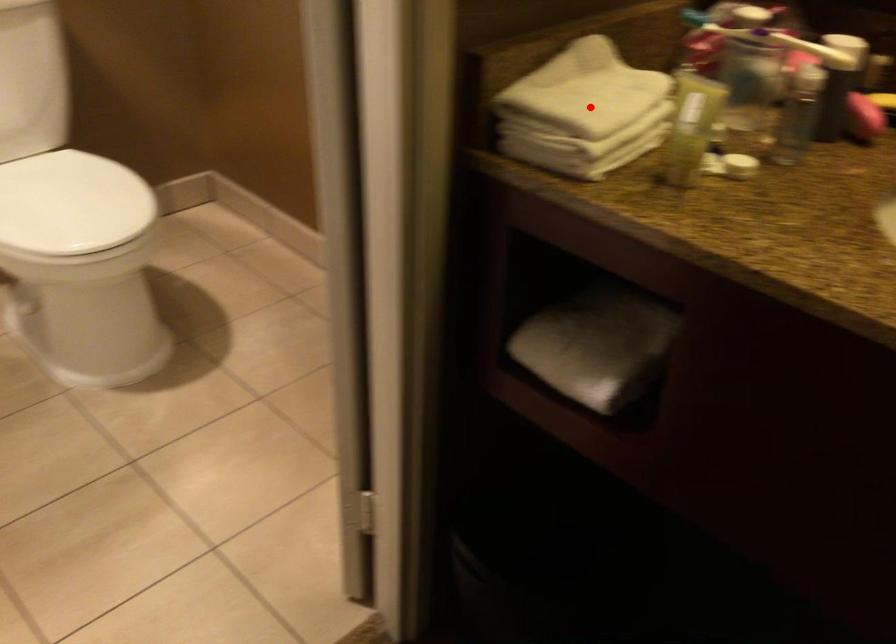
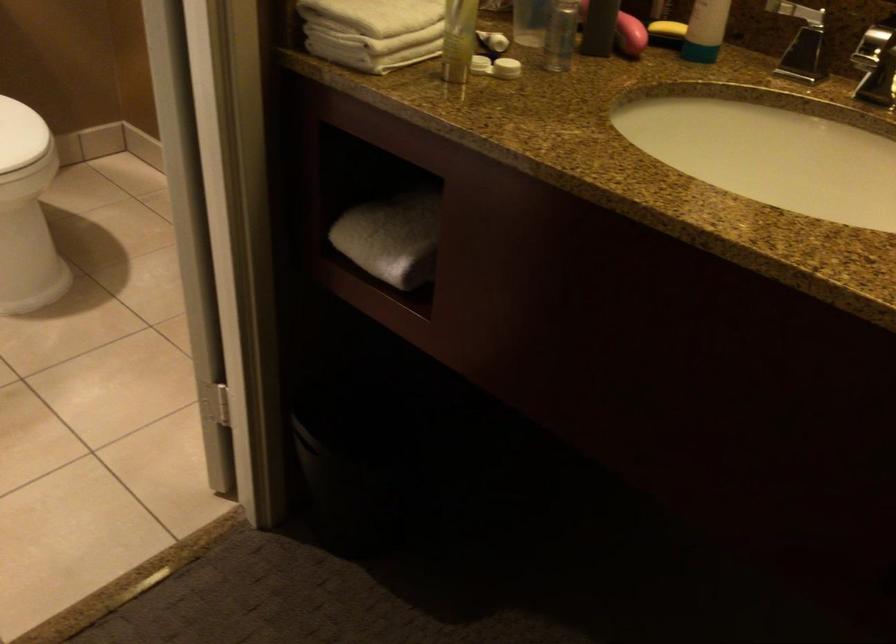
Question: I am providing you with two images of the same scene from different viewpoints. Image1 has a red point marked. In image2, the corresponding 3D location appears at what relative position? Reply with the corresponding letter.

Choices:
 (A) Closer
 (B) Farther

Answer: (B)